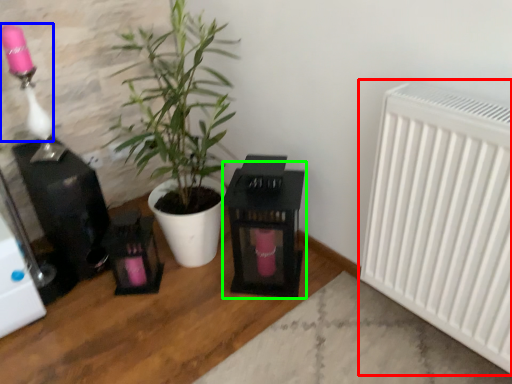
Question: Which is farther away from radiator (highlighted by a red box)? lamp (highlighted by a blue box) or table (highlighted by a green box)?

Choices:
 (A) lamp
 (B) table

Answer: (A)